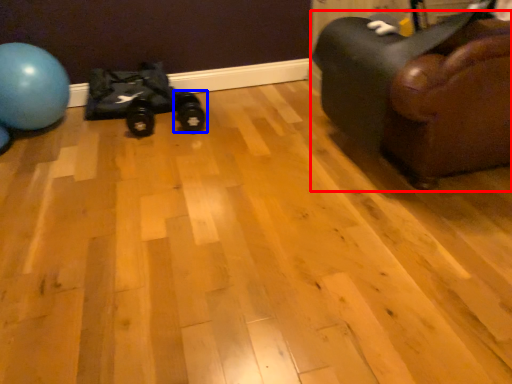
Question: Among these objects, which one is nearest to the camera, furniture (highlighted by a red box) or footwear (highlighted by a blue box)?

Choices:
 (A) furniture
 (B) footwear

Answer: (A)